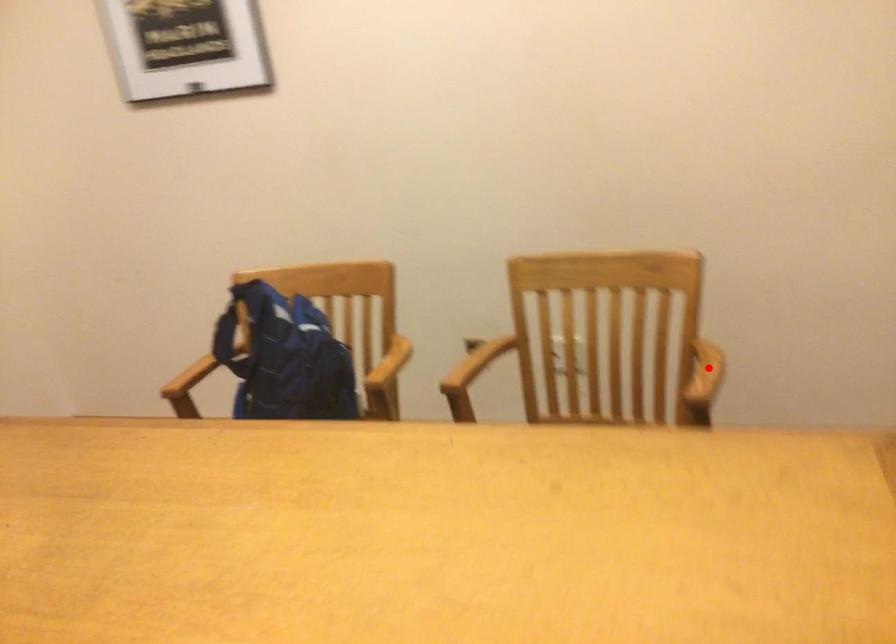
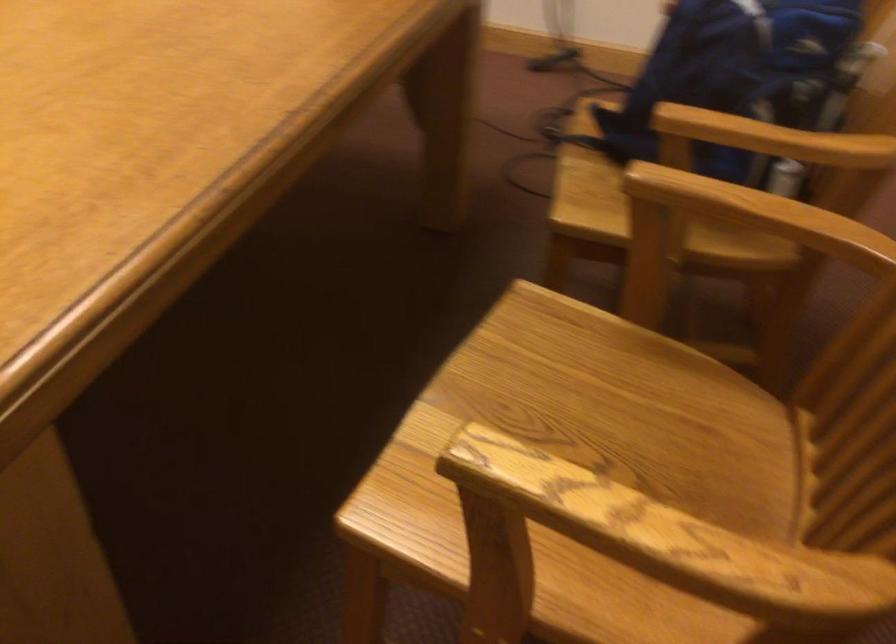
Question: A red point is marked in image1. In image2, is the corresponding 3D point closer to the camera or farther? Reply with the corresponding letter.

Choices:
 (A) The corresponding 3D point is closer.
 (B) The corresponding 3D point is farther.

Answer: (A)